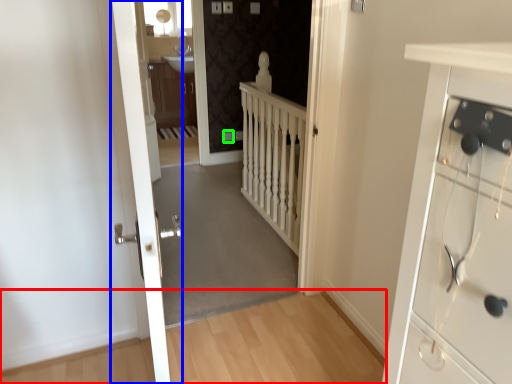
Question: Based on their relative distances, which object is farther from path (highlighted by a red box)? Choose from door (highlighted by a blue box) and electric outlet (highlighted by a green box).

Choices:
 (A) door
 (B) electric outlet

Answer: (B)